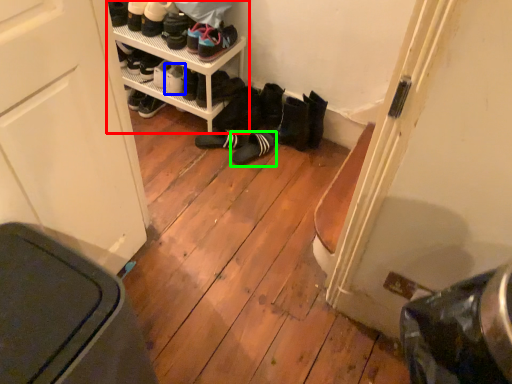
Question: Considering the real-world distances, which object is closest to shelf (highlighted by a red box)? footwear (highlighted by a blue box) or footwear (highlighted by a green box).

Choices:
 (A) footwear
 (B) footwear

Answer: (A)